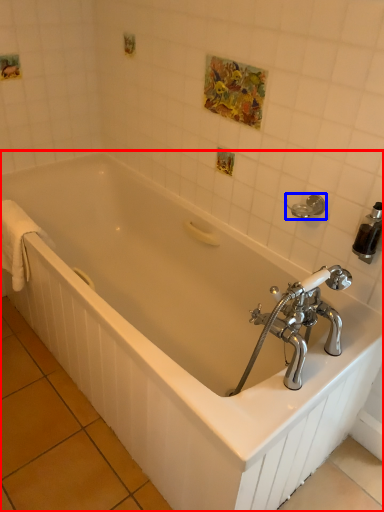
Question: Among these objects, which one is farthest to the camera, bathtub (highlighted by a red box) or towel bar (highlighted by a blue box)?

Choices:
 (A) bathtub
 (B) towel bar

Answer: (B)